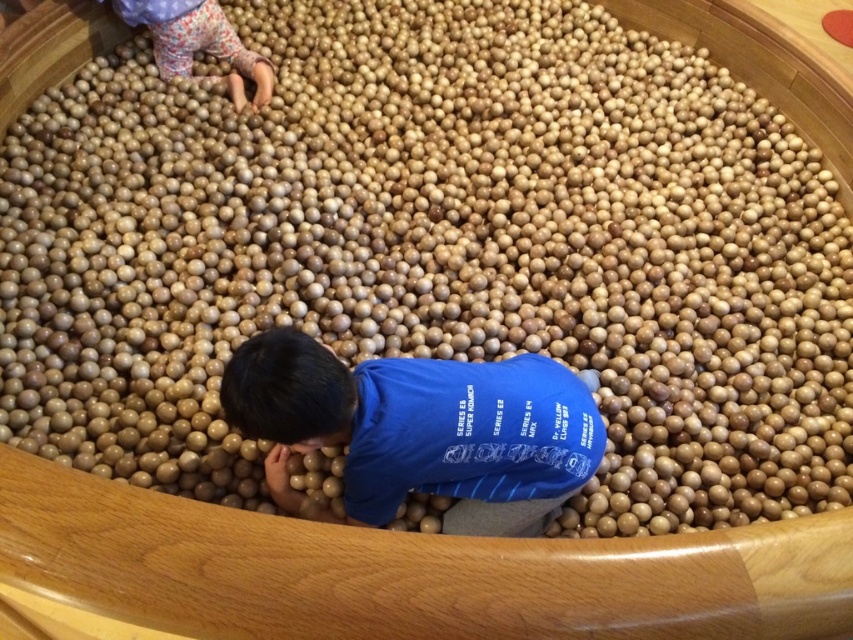
Consider the image. You are a parent looking for your child in a ball pit. You see the blue matte shirt at center. Where would you look to find your child?

The blue matte shirt at center is located at the coordinates point (419,429), so you should look towards the center area of the ball pit to find your child.

You are a parent trying to locate your child in the ball pit. You see the blue matte shirt at center and the floral fabric pants at upper left. Which one is closer to you?

The blue matte shirt at center is closer to you because it is in front of the floral fabric pants at upper left.

You are a parent trying to locate your child in a crowded ball pit. You see the blue matte shirt at center and the floral fabric pants at upper left. Which clothing item is closer to you?

The blue matte shirt at center is closer to you since it is only 1.73 meters away from the floral fabric pants at upper left, but the exact distance from you isn